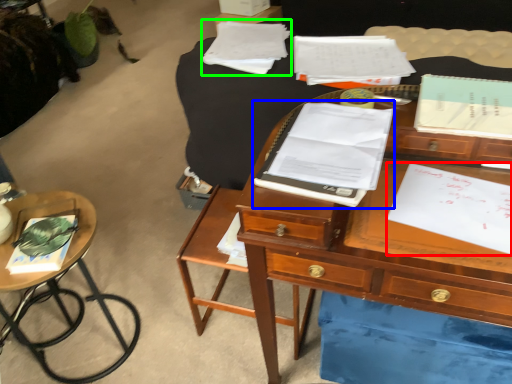
Question: Which object is the farthest from document (highlighted by a red box)? Choose among these: notebook (highlighted by a blue box) or notebook (highlighted by a green box).

Choices:
 (A) notebook
 (B) notebook

Answer: (B)